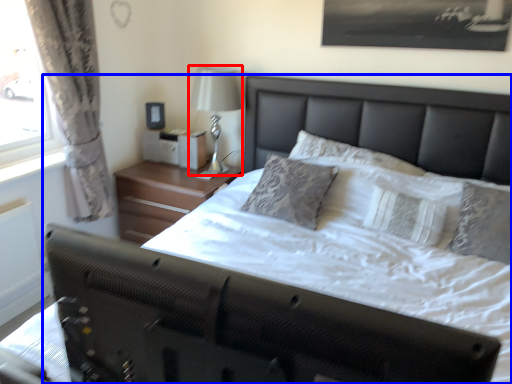
Question: Among these objects, which one is farthest to the camera, bedside lamp (highlighted by a red box) or bed (highlighted by a blue box)?

Choices:
 (A) bedside lamp
 (B) bed

Answer: (A)